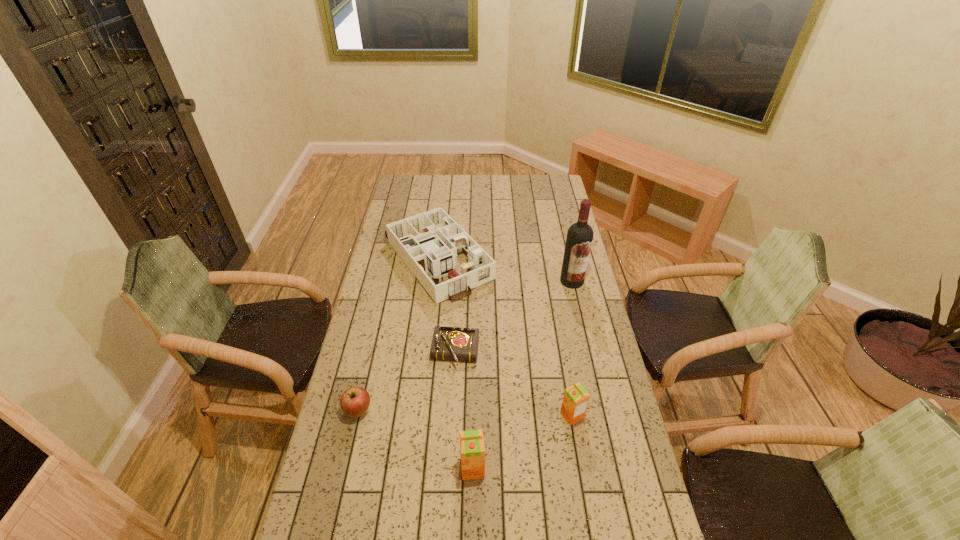
Locate an element on the screen. The width and height of the screenshot is (960, 540). the fifth shortest object is located at coordinates tap(472, 450).

Identify the location of the taller orange juice. Image resolution: width=960 pixels, height=540 pixels. (472, 450).

Identify the location of the shorter orange juice. The width and height of the screenshot is (960, 540). (575, 401).

Find the location of a particular element. The image size is (960, 540). the fifth object from left to right is located at coordinates (575, 401).

Image resolution: width=960 pixels, height=540 pixels. Find the location of `dollhouse`. dollhouse is located at coordinates (422, 248).

Where is `wine bottle`? The height and width of the screenshot is (540, 960). wine bottle is located at coordinates (579, 239).

This screenshot has height=540, width=960. I want to click on the rightmost object, so click(579, 239).

Find the location of a particular element. This screenshot has height=540, width=960. apple is located at coordinates (354, 402).

Locate an element on the screen. The height and width of the screenshot is (540, 960). the shortest object is located at coordinates (457, 344).

Find the location of a particular element. This screenshot has height=540, width=960. the fourth nearest object is located at coordinates (457, 344).